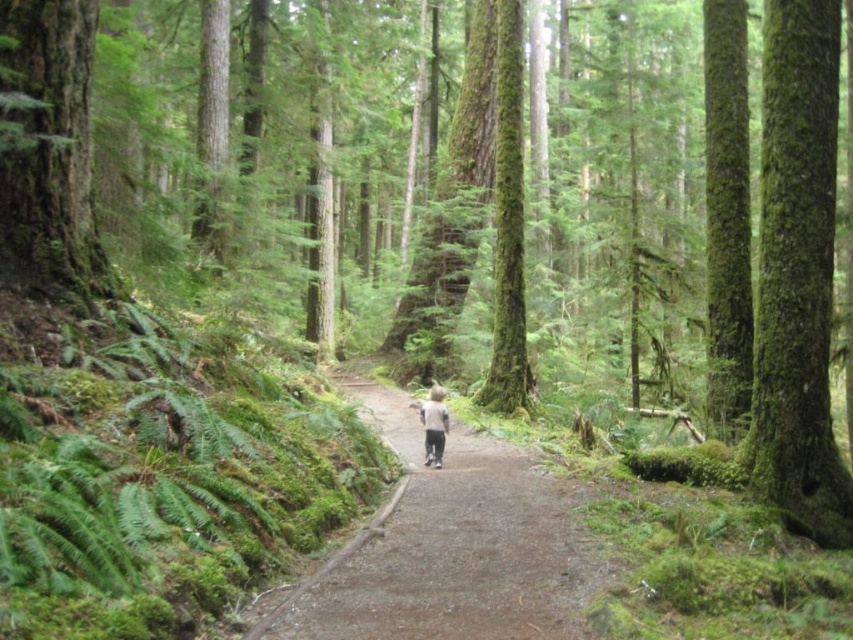
Based on the photo, who is taller, dirt path at center or green mossy tree trunk at right?

Standing taller between the two is green mossy tree trunk at right.

Does dirt path at center have a lesser height compared to green mossy tree trunk at right?

Yes.

Is point (402, 496) in front of point (809, 61)?

No, (402, 496) is further to viewer.

This screenshot has width=853, height=640. What are the coordinates of `dirt path at center` in the screenshot? It's located at (450, 547).

Which is more to the right, green mossy tree trunk at right or light gray fabric at center?

From the viewer's perspective, green mossy tree trunk at right appears more on the right side.

Who is more distant from viewer, (778, 12) or (442, 400)?

The point (442, 400) is behind.

Identify the location of green mossy tree trunk at right. (798, 275).

Who is more distant from viewer, (804, 448) or (16, 230)?

Positioned behind is point (804, 448).

Which is in front, point (802, 403) or point (117, 280)?

Point (117, 280)

Where is `green mossy tree trunk at right`? green mossy tree trunk at right is located at coordinates (798, 275).